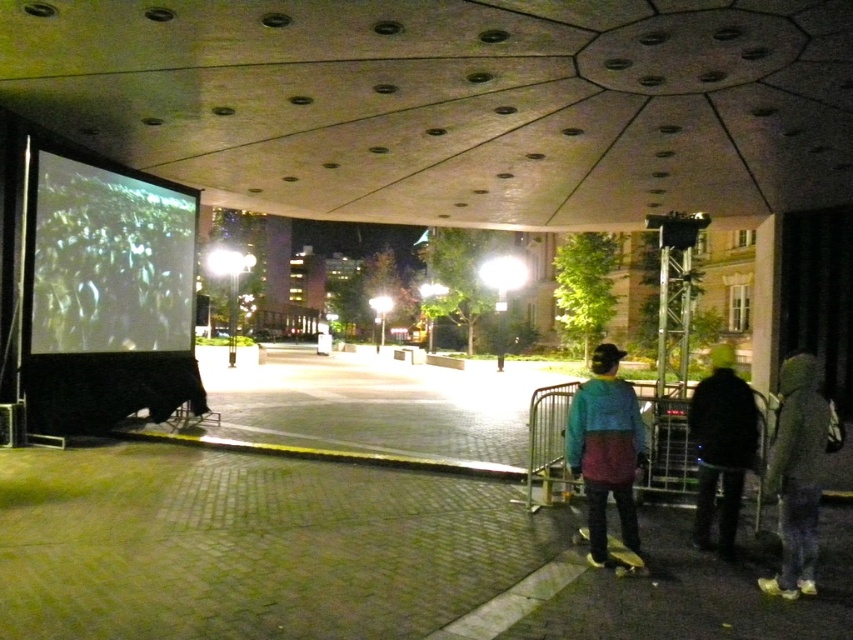
Can you confirm if white matte projection screen at left is shorter than dark gray hoodie at lower right?

No, white matte projection screen at left is not shorter than dark gray hoodie at lower right.

Is white matte projection screen at left bigger than dark gray hoodie at lower right?

No, white matte projection screen at left is not bigger than dark gray hoodie at lower right.

Is point (126, 228) closer to camera compared to point (747, 412)?

No, it is not.

Identify the location of white matte projection screen at left. (109, 260).

Can you confirm if multicolored sweater at center is smaller than dark gray hoodie at lower right?

Yes, multicolored sweater at center is smaller than dark gray hoodie at lower right.

Is multicolored sweater at center to the left of dark gray hoodie at lower right from the viewer's perspective?

Correct, you'll find multicolored sweater at center to the left of dark gray hoodie at lower right.

Describe the element at coordinates (605, 449) in the screenshot. I see `multicolored sweater at center` at that location.

Locate an element on the screen. The width and height of the screenshot is (853, 640). multicolored sweater at center is located at coordinates (605, 449).

Can you confirm if multicolored sweater at center is positioned above green fuzzy jacket at lower right?

Yes, multicolored sweater at center is above green fuzzy jacket at lower right.

Does point (604, 458) come behind point (767, 467)?

No, it is not.

The image size is (853, 640). What do you see at coordinates (605, 449) in the screenshot? I see `multicolored sweater at center` at bounding box center [605, 449].

Locate an element on the screen. Image resolution: width=853 pixels, height=640 pixels. multicolored sweater at center is located at coordinates (605, 449).